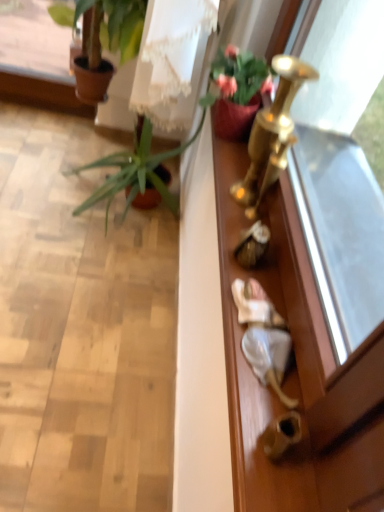
Question: From the image's perspective, relative to matte pink pot at upper right, positioned as the 3th houseplant in back-to-front order, is green leafy plant at left, placed as the first houseplant when sorted from back to front, above or below?

Choices:
 (A) below
 (B) above

Answer: (B)

Question: In the image, is green leafy plant at left, which is counted as the third houseplant, starting from the front, positioned in front of or behind matte pink pot at upper right, positioned as the 3th houseplant in back-to-front order?

Choices:
 (A) behind
 (B) front

Answer: (A)

Question: Which object is positioned farthest from the gold metallic door handle at lower right?

Choices:
 (A) matte pink pot at upper right, positioned as the 3th houseplant in back-to-front order
 (B) green matte plant at upper left, the second houseplant positioned from the front
 (C) gold metallic screen door at right
 (D) green leafy plant at left, which is counted as the third houseplant, starting from the front

Answer: (B)

Question: Which is nearer to the green leafy plant at left, which is counted as the third houseplant, starting from the front?

Choices:
 (A) matte pink pot at upper right, positioned as the 3th houseplant in back-to-front order
 (B) green matte plant at upper left, marked as the second houseplant in a back-to-front arrangement
 (C) gold metallic screen door at right
 (D) gold metallic door handle at lower right

Answer: (B)